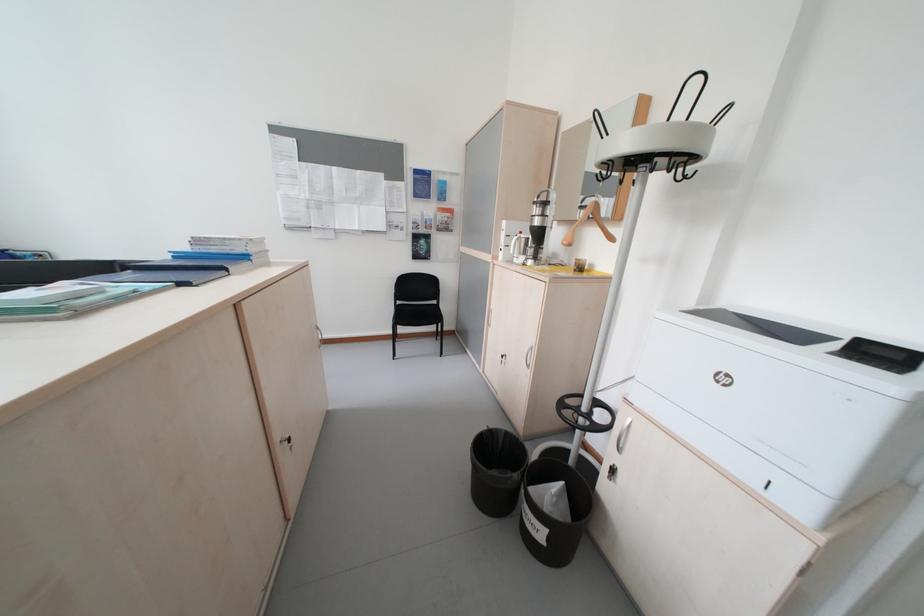
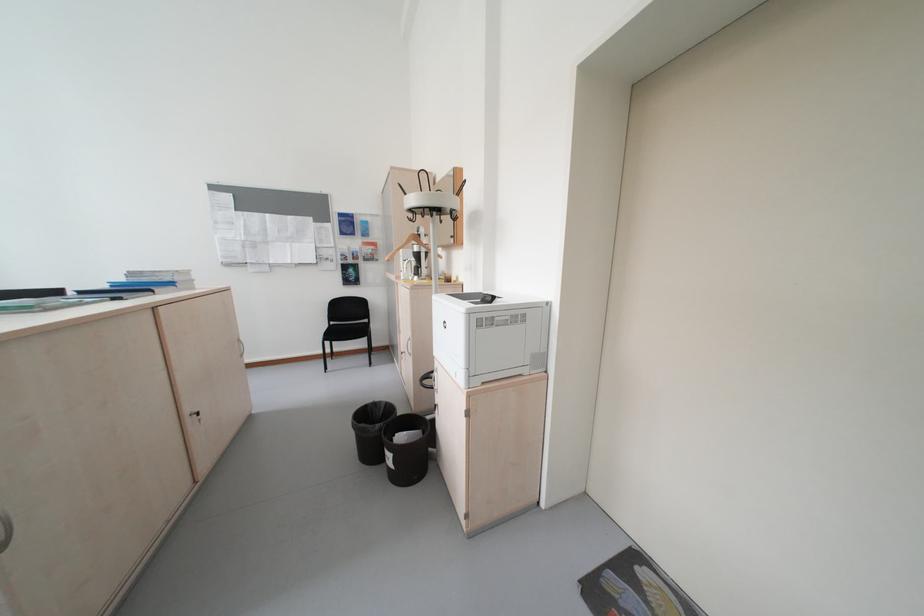
From the picture: Which direction would the cameraman need to move to produce the second image?

The movement direction of the cameraman is right, backward.